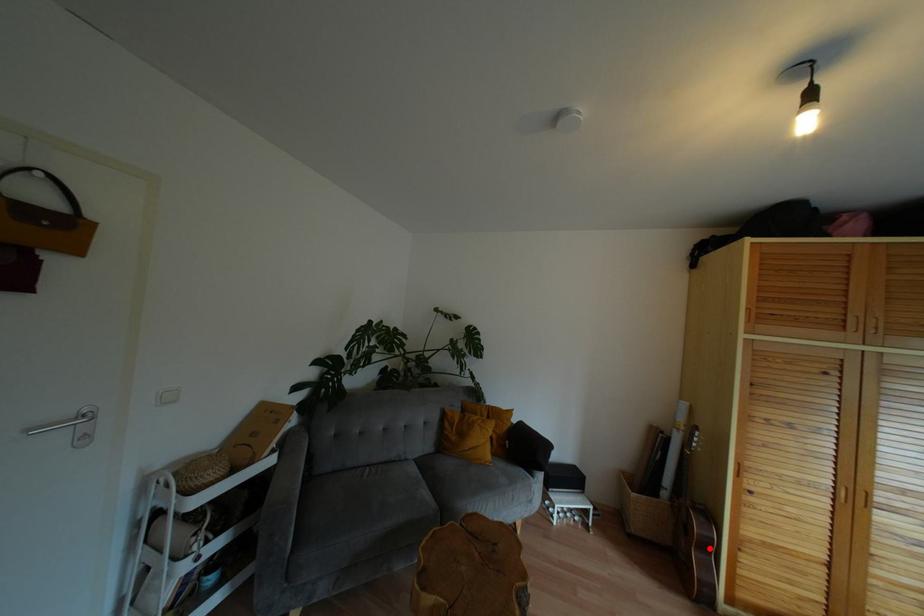
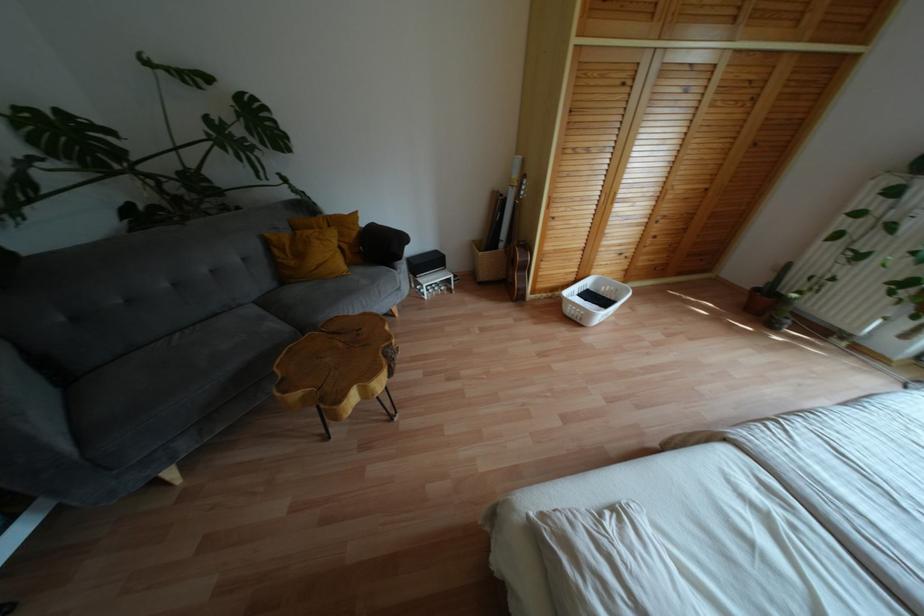
The point at the highlighted location is marked in the first image. Where is the corresponding point in the second image?

(525, 267)